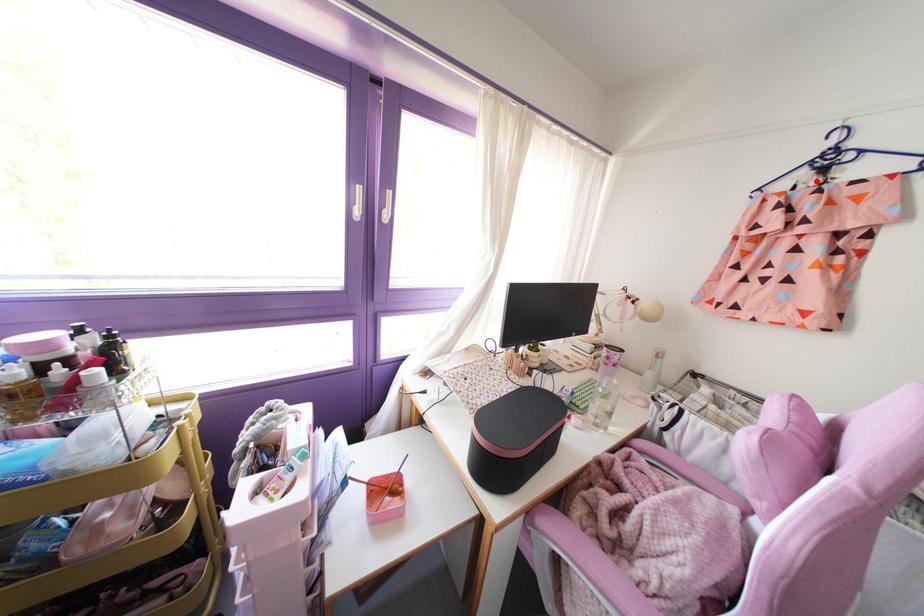
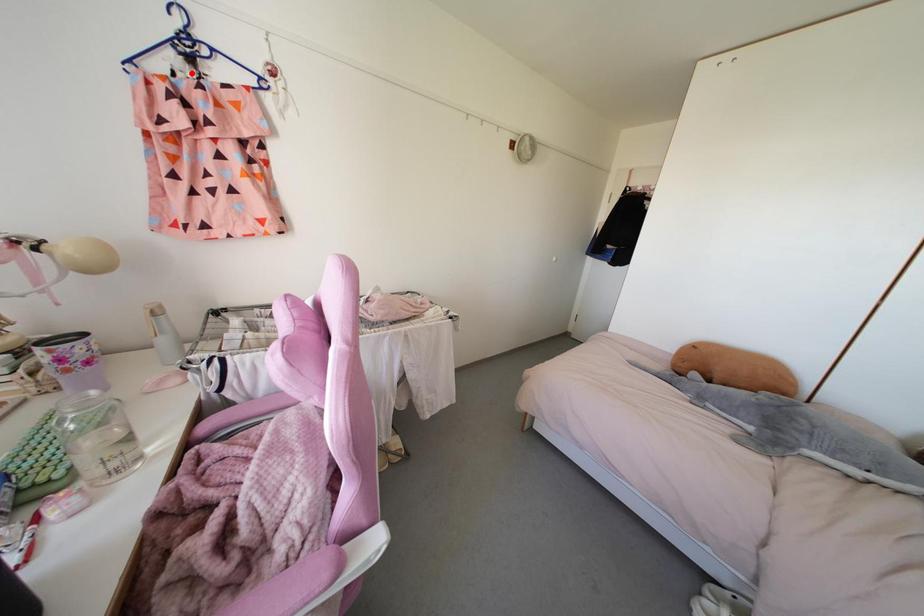
I am providing you with two images of the same scene from different viewpoints. A red point is marked on the first image and another point is marked on the second image. Is the red point in image1 aligned with the point shown in image2?

Yes